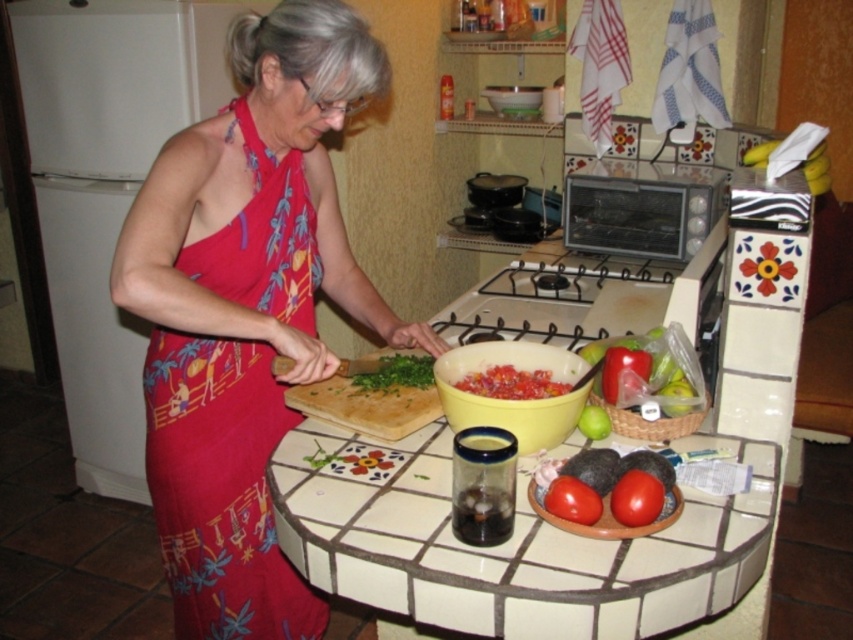
Question: Is red floral fabric dress at left positioned at the back of smooth red tomato at lower right?

Choices:
 (A) no
 (B) yes

Answer: (B)

Question: Estimate the real-world distances between objects in this image. Which object is farther from the smooth red tomato at lower right?

Choices:
 (A) white tile countertop at center
 (B) green leafy vegetable at center
 (C) red matte tomato at center

Answer: (B)

Question: Is red matte tomato at center bigger than green matte apple at center?

Choices:
 (A) no
 (B) yes

Answer: (B)

Question: Which object is positioned farthest from the shiny plastic bag at right?

Choices:
 (A) wooden at center
 (B) red matte tomato at center
 (C) red matte tomato at lower right
 (D) smooth red tomato at lower right

Answer: (A)

Question: Considering the real-world distances, which object is farthest from the smooth red tomato at lower right?

Choices:
 (A) red matte tomato at center
 (B) red matte tomato at lower right

Answer: (B)

Question: From the image, what is the correct spatial relationship of smooth red tomato at lower right in relation to red matte tomato at center?

Choices:
 (A) above
 (B) below

Answer: (B)